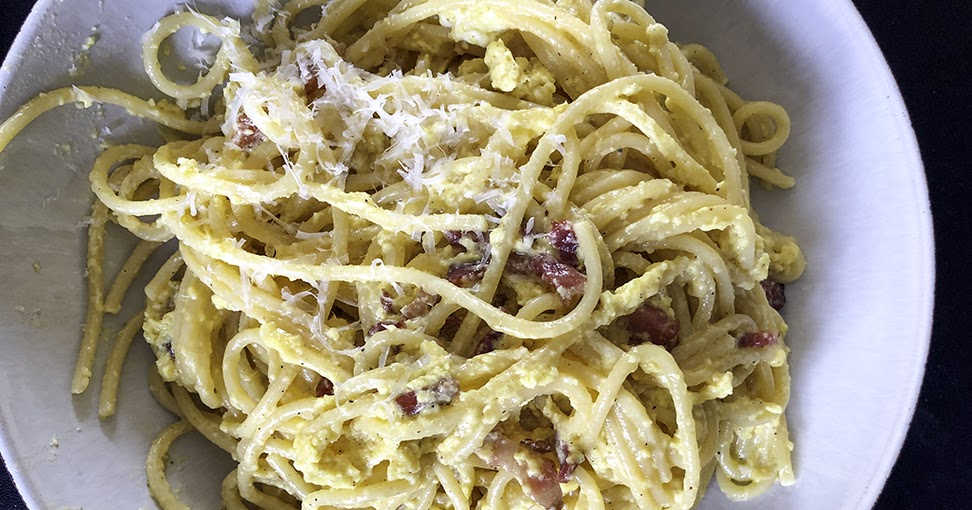
Find the location of a particular element. Image resolution: width=972 pixels, height=510 pixels. table top is located at coordinates (946, 43).